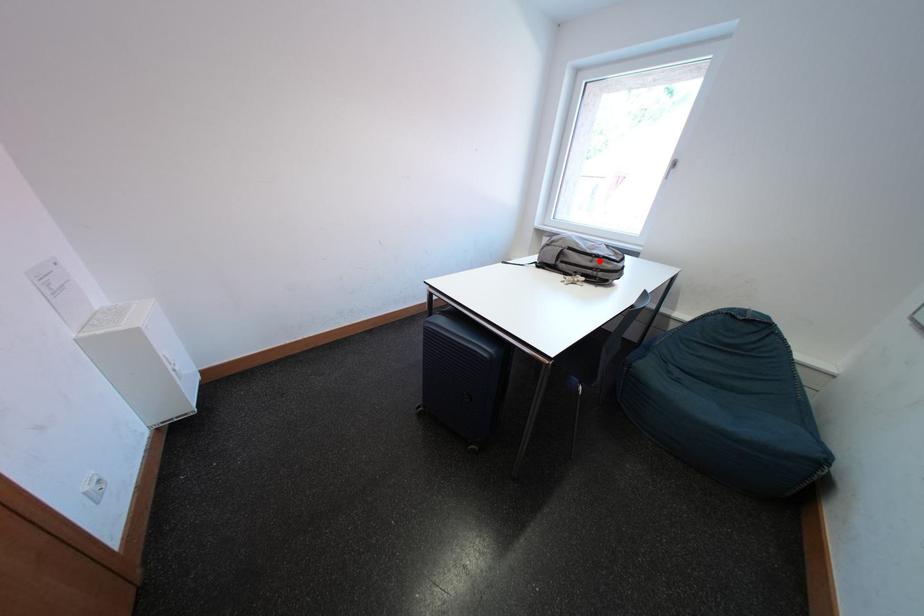
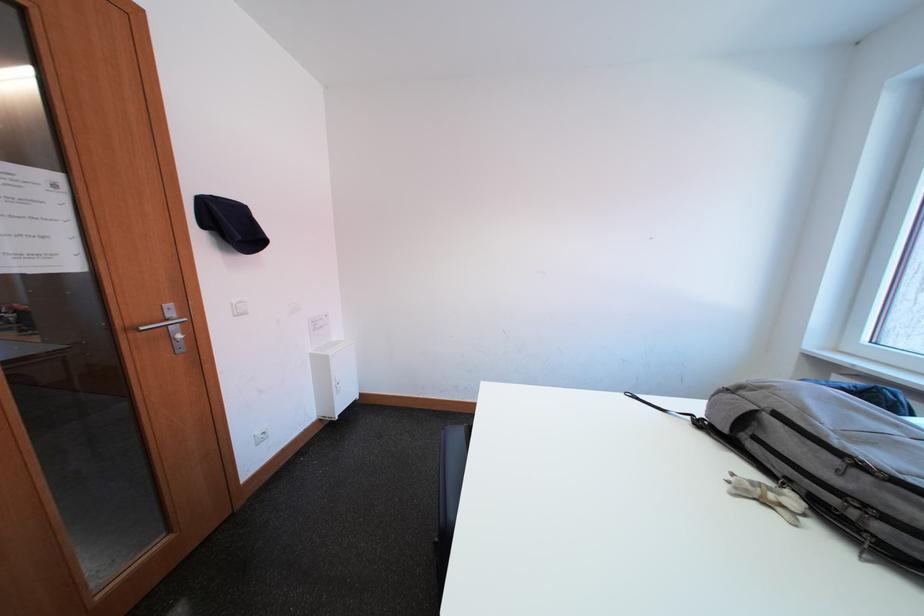
Where in the second image is the point corresponding to the highlighted location from the first image?

(844, 464)